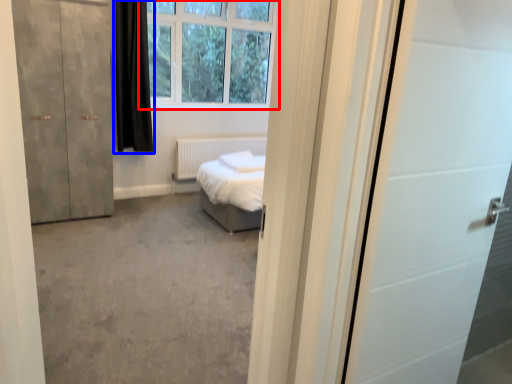
Question: Which point is further to the camera, window (highlighted by a red box) or curtain (highlighted by a blue box)?

Choices:
 (A) window
 (B) curtain

Answer: (A)